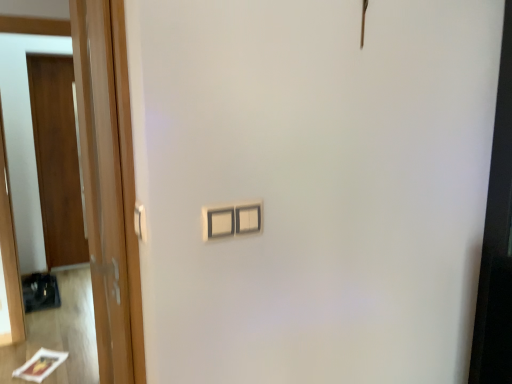
Question: Can you confirm if wooden door at left, which ranks as the second door in left-to-right order, is smaller than white plastic light switch at center?

Choices:
 (A) yes
 (B) no

Answer: (B)

Question: Considering the relative sizes of wooden door at left, which is counted as the 1th door, starting from the right, and white plastic light switch at center in the image provided, is wooden door at left, which is counted as the 1th door, starting from the right, shorter than white plastic light switch at center?

Choices:
 (A) yes
 (B) no

Answer: (B)

Question: From the image's perspective, would you say wooden door at left, which is the 1th door from front to back, is shown under white plastic light switch at center?

Choices:
 (A) no
 (B) yes

Answer: (B)

Question: Is wooden door at left, which is counted as the 1th door, starting from the right, positioned beyond the bounds of white plastic light switch at center?

Choices:
 (A) yes
 (B) no

Answer: (A)

Question: Is wooden door at left, acting as the 2th door starting from the back, taller than white plastic light switch at center?

Choices:
 (A) no
 (B) yes

Answer: (B)

Question: Is wooden door at left, which is the 2th door from right to left, in front of or behind white plastic door handle at left in the image?

Choices:
 (A) behind
 (B) front

Answer: (A)

Question: From a real-world perspective, is wooden door at left, arranged as the 2th door when viewed from the front, physically located above or below white plastic door handle at left?

Choices:
 (A) above
 (B) below

Answer: (B)

Question: Is wooden door at left, arranged as the 2th door when viewed from the front, taller or shorter than white plastic door handle at left?

Choices:
 (A) short
 (B) tall

Answer: (B)

Question: From the image's perspective, is wooden door at left, the 1th door from the left, positioned above or below white plastic door handle at left?

Choices:
 (A) below
 (B) above

Answer: (B)

Question: Is white plastic light switch at center to the left or to the right of wooden door at left in the image?

Choices:
 (A) left
 (B) right

Answer: (B)

Question: Is white plastic light switch at center spatially inside wooden door at left, or outside of it?

Choices:
 (A) inside
 (B) outside

Answer: (B)

Question: Considering their positions, is white plastic light switch at center located in front of or behind wooden door at left?

Choices:
 (A) behind
 (B) front

Answer: (B)

Question: From the image's perspective, is white plastic light switch at center above or below wooden door at left?

Choices:
 (A) below
 (B) above

Answer: (A)

Question: From the image's perspective, is wooden door at left located above or below white plastic light switch at center?

Choices:
 (A) below
 (B) above

Answer: (B)

Question: From a real-world perspective, is wooden door at left above or below white plastic light switch at center?

Choices:
 (A) above
 (B) below

Answer: (B)